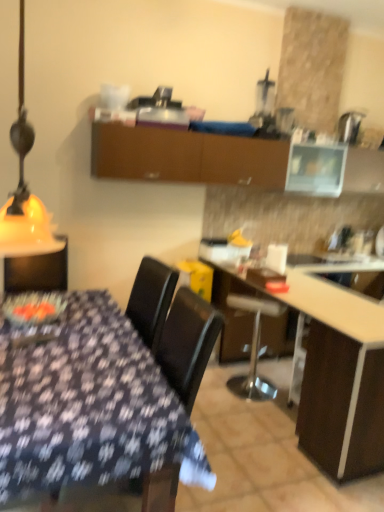
This screenshot has height=512, width=384. What are the coordinates of `free space in front of metallic silver bar stool at center` in the screenshot? It's located at (255, 411).